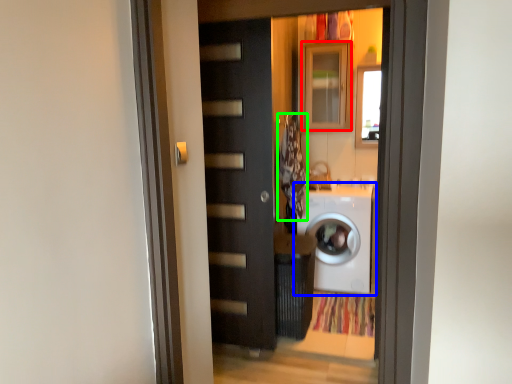
Question: Considering the real-world distances, which object is closest to cabinetry (highlighted by a red box)? washing machine (highlighted by a blue box) or laundry (highlighted by a green box).

Choices:
 (A) washing machine
 (B) laundry

Answer: (B)